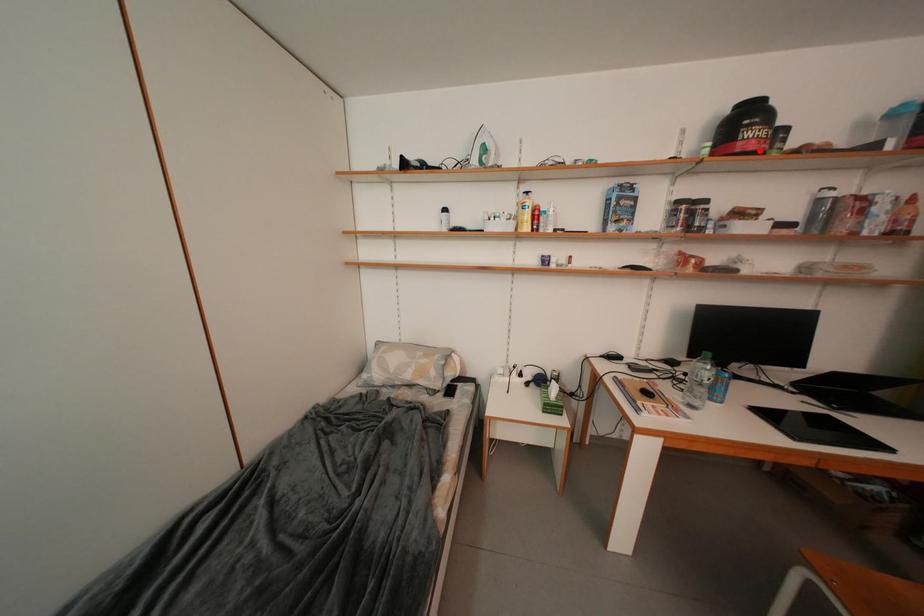
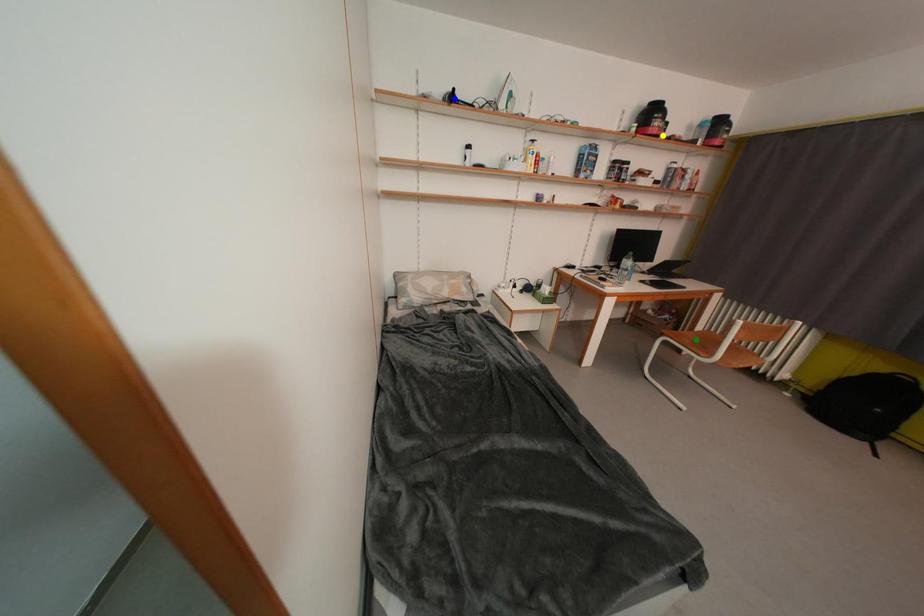
Question: I am providing you with two images of the same scene from different viewpoints. A red point is marked on the first image. You are given multiple points on the second image. Which point in image 2 represents the same 3d spot as the red point in image 1?

Choices:
 (A) yellow point
 (B) blue point
 (C) green point

Answer: (A)